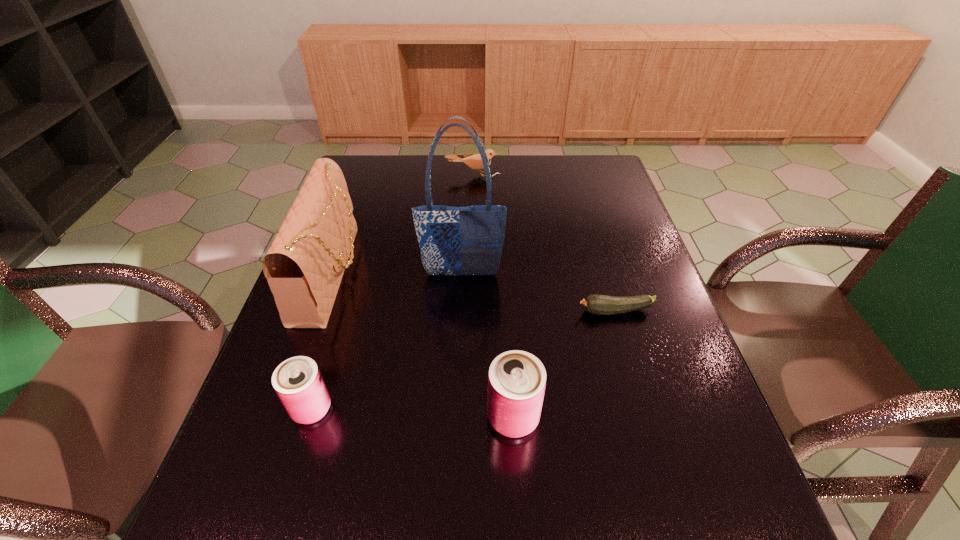
Find the location of a particular element. The width and height of the screenshot is (960, 540). empty location between the fifth shortest object and the taller can is located at coordinates (422, 346).

The image size is (960, 540). In order to click on object that is the closest one to the handbag in this screenshot , I will do `click(298, 382)`.

The image size is (960, 540). I want to click on the second closest object to the fourth tallest object, so click(517, 379).

This screenshot has height=540, width=960. I want to click on blank area in the image that satisfies the following two spatial constraints: 1. at the beak of the farthest object; 2. on the left side of the taller can, so click(x=468, y=417).

Find the location of a particular element. This screenshot has width=960, height=540. vacant space that satisfies the following two spatial constraints: 1. on the front-facing side of the tallest object; 2. on the right side of the right can is located at coordinates (456, 417).

Locate an element on the screen. vacant space that satisfies the following two spatial constraints: 1. at the beak of the farthest object; 2. on the front-facing side of the handbag is located at coordinates (470, 274).

The image size is (960, 540). What are the coordinates of `vacant space that satisfies the following two spatial constraints: 1. at the beak of the fourth shortest object; 2. on the right side of the bird` in the screenshot? It's located at (468, 417).

Find the location of a particular element. The width and height of the screenshot is (960, 540). free spot that satisfies the following two spatial constraints: 1. on the front side of the left can; 2. on the right side of the fourth shortest object is located at coordinates (309, 417).

Identify the location of vacant space that satisfies the following two spatial constraints: 1. at the blossom end of the shortest object; 2. on the front side of the shorter can. The image size is (960, 540). (644, 408).

I want to click on free space that satisfies the following two spatial constraints: 1. on the front-facing side of the left can; 2. on the right side of the second tallest object, so click(x=285, y=408).